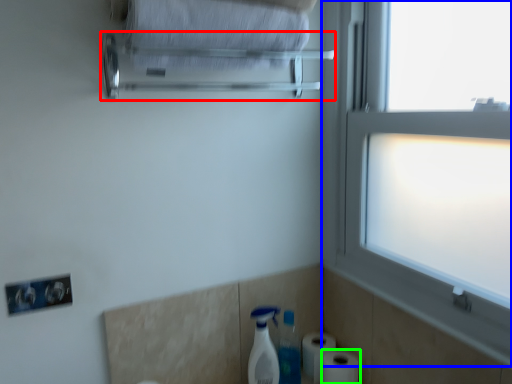
Question: Which object is the farthest from towel bar (highlighted by a red box)? Choose among these: window (highlighted by a blue box) or toilet paper (highlighted by a green box).

Choices:
 (A) window
 (B) toilet paper

Answer: (B)